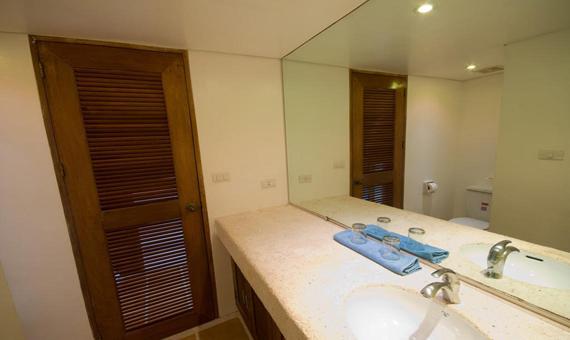
Find the location of `blue towel under glasses`. blue towel under glasses is located at coordinates (372, 252).